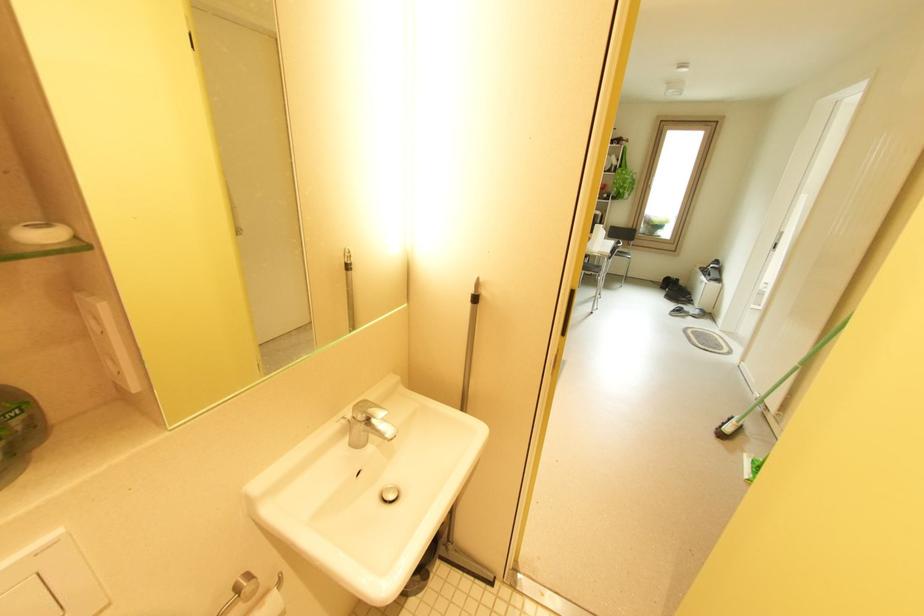
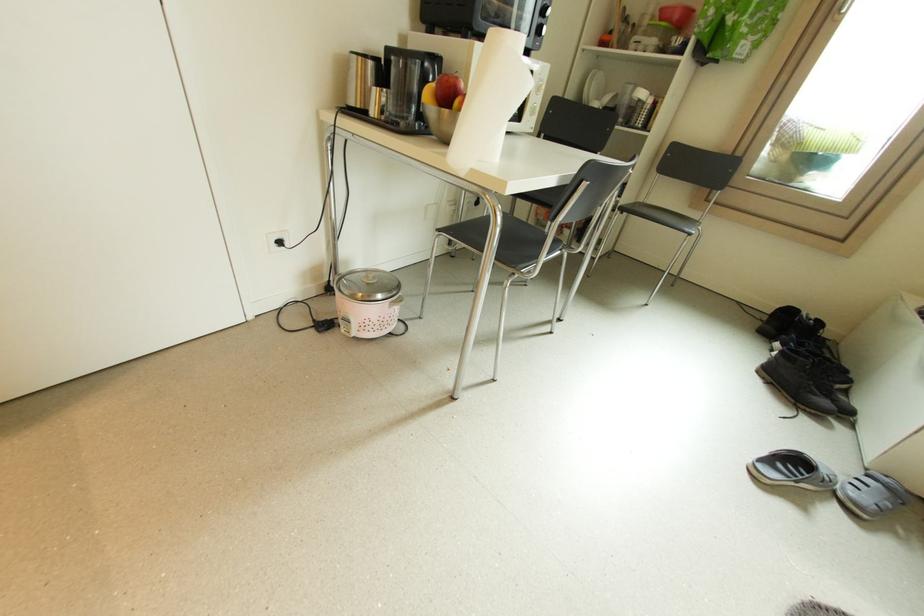
The point at (x=689, y=300) is marked in the first image. Where is the corresponding point in the second image?

(830, 403)